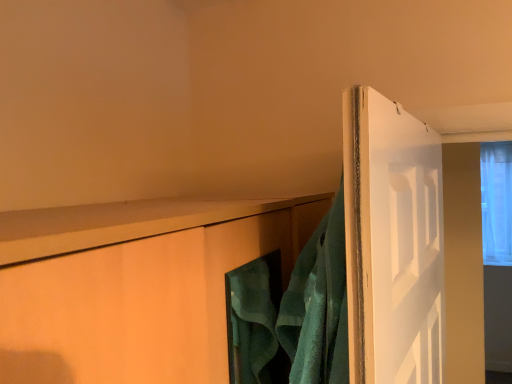
Question: Does transparent glass window at upper right have a greater width compared to green terry cloth towel at upper right?

Choices:
 (A) no
 (B) yes

Answer: (B)

Question: Does transparent glass window at upper right have a larger size compared to green terry cloth towel at upper right?

Choices:
 (A) yes
 (B) no

Answer: (A)

Question: From a real-world perspective, is transparent glass window at upper right on green terry cloth towel at upper right?

Choices:
 (A) yes
 (B) no

Answer: (A)

Question: Is transparent glass window at upper right to the right of green terry cloth towel at upper right from the viewer's perspective?

Choices:
 (A) no
 (B) yes

Answer: (B)

Question: From a real-world perspective, is transparent glass window at upper right physically below green terry cloth towel at upper right?

Choices:
 (A) no
 (B) yes

Answer: (A)

Question: Is transparent glass window at upper right facing away from green terry cloth towel at upper right?

Choices:
 (A) yes
 (B) no

Answer: (B)

Question: Is transparent glass window at upper right surrounded by green terry cloth towel at upper right?

Choices:
 (A) yes
 (B) no

Answer: (B)

Question: Does green terry cloth towel at upper right have a lesser height compared to transparent glass window at upper right?

Choices:
 (A) no
 (B) yes

Answer: (B)

Question: Is green terry cloth towel at upper right to the right of transparent glass window at upper right from the viewer's perspective?

Choices:
 (A) yes
 (B) no

Answer: (B)

Question: Does green terry cloth towel at upper right have a lesser width compared to transparent glass window at upper right?

Choices:
 (A) no
 (B) yes

Answer: (B)

Question: Considering the relative sizes of green terry cloth towel at upper right and transparent glass window at upper right in the image provided, is green terry cloth towel at upper right bigger than transparent glass window at upper right?

Choices:
 (A) yes
 (B) no

Answer: (B)

Question: Would you consider green terry cloth towel at upper right to be distant from transparent glass window at upper right?

Choices:
 (A) no
 (B) yes

Answer: (B)

Question: Is point (326, 339) closer or farther from the camera than point (500, 177)?

Choices:
 (A) closer
 (B) farther

Answer: (A)